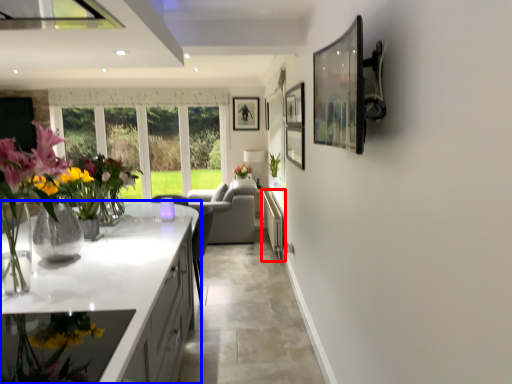
Question: Which point is closer to the camera, cabinetry (highlighted by a red box) or countertop (highlighted by a blue box)?

Choices:
 (A) cabinetry
 (B) countertop

Answer: (B)